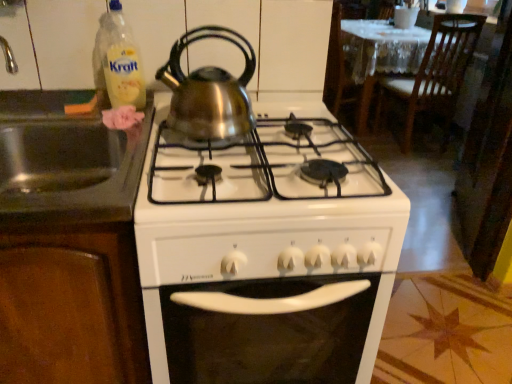
Locate an element on the screen. This screenshot has height=384, width=512. translucent plastic bottle at upper left is located at coordinates (121, 60).

Describe the element at coordinates (437, 73) in the screenshot. The height and width of the screenshot is (384, 512). I see `wooden chair at upper right` at that location.

The height and width of the screenshot is (384, 512). Find the location of `stained wood cabinet at left`. stained wood cabinet at left is located at coordinates (109, 277).

You are a GUI agent. You are given a task and a screenshot of the screen. Output one action in this format:
    pyautogui.click(x=<x>, y=<y>)
    Task: Click on the white glossy gas stove at center
    The image size is (512, 384).
    Given the screenshot: What is the action you would take?
    pyautogui.click(x=264, y=254)

Identify the location of translucent plastic bottle at upper left. This screenshot has height=384, width=512. (121, 60).

How different are the orientations of translucent plastic bottle at upper left and satin silver kettle at upper center in degrees?

The facing directions of translucent plastic bottle at upper left and satin silver kettle at upper center are 0.68 degrees apart.

Is translucent plastic bottle at upper left facing away from satin silver kettle at upper center?

translucent plastic bottle at upper left does not have its back to satin silver kettle at upper center.

Find the location of a particular element. bottle behind the satin silver kettle at upper center is located at coordinates (121, 60).

Is translucent plastic bottle at upper left not near satin silver kettle at upper center?

They are positioned close to each other.

Is stainless steel sink at left looking in the opposite direction of wooden chair at upper right?

No, wooden chair at upper right is not at the back of stainless steel sink at left.

Does stainless steel sink at left have a smaller size compared to wooden chair at upper right?

Yes.

Is point (13, 150) closer or farther from the camera than point (460, 20)?

Point (13, 150) appears to be closer to the viewer than point (460, 20).

Is point (245, 282) less distant than point (57, 205)?

Yes, point (245, 282) is in front of point (57, 205).

In the scene shown: Considering the positions of objects white glossy gas stove at center and stainless steel sink at left in the image provided, who is more to the right, white glossy gas stove at center or stainless steel sink at left?

Positioned to the right is white glossy gas stove at center.

Is white glossy gas stove at center oriented towards stainless steel sink at left?

No, white glossy gas stove at center is not turned towards stainless steel sink at left.

Considering the sizes of objects white glossy gas stove at center and stainless steel sink at left in the image provided, who is bigger, white glossy gas stove at center or stainless steel sink at left?

Bigger between the two is white glossy gas stove at center.

Who is smaller, satin silver kettle at upper center or wooden chair at upper right?

satin silver kettle at upper center.

Where is `chair behind the satin silver kettle at upper center`? The image size is (512, 384). chair behind the satin silver kettle at upper center is located at coordinates (437, 73).

Does point (233, 119) appear closer or farther from the camera than point (454, 59)?

Point (233, 119) appears to be closer to the viewer than point (454, 59).

Considering the relative sizes of translucent plastic bottle at upper left and stained wood cabinet at left in the image provided, is translucent plastic bottle at upper left thinner than stained wood cabinet at left?

Correct, the width of translucent plastic bottle at upper left is less than that of stained wood cabinet at left.

Is translucent plastic bottle at upper left spatially inside stained wood cabinet at left, or outside of it?

translucent plastic bottle at upper left cannot be found inside stained wood cabinet at left.

Based on their sizes in the image, would you say translucent plastic bottle at upper left is bigger or smaller than stained wood cabinet at left?

Considering their sizes, translucent plastic bottle at upper left takes up less space than stained wood cabinet at left.

Is translucent plastic bottle at upper left facing away from stained wood cabinet at left?

That's not correct — translucent plastic bottle at upper left is not looking away from stained wood cabinet at left.

Is stained wood cabinet at left bigger than white glossy gas stove at center?

Indeed, stained wood cabinet at left has a larger size compared to white glossy gas stove at center.

Between point (132, 335) and point (223, 144), which one is positioned in front?

The point (132, 335) is closer.

From a real-world perspective, who is located higher, stained wood cabinet at left or white glossy gas stove at center?

In real-world perspective, stained wood cabinet at left is above.

Based on the photo, can we say stainless steel sink at left lies outside translucent plastic bottle at upper left?

Yes, stainless steel sink at left is outside of translucent plastic bottle at upper left.

Can you confirm if stainless steel sink at left is wider than translucent plastic bottle at upper left?

Correct, the width of stainless steel sink at left exceeds that of translucent plastic bottle at upper left.

Is stainless steel sink at left closer to camera compared to translucent plastic bottle at upper left?

Yes.

From the image's perspective, is stainless steel sink at left located above translucent plastic bottle at upper left?

Incorrect, from the image's perspective, stainless steel sink at left is lower than translucent plastic bottle at upper left.

Locate an element on the screen. Image resolution: width=512 pixels, height=384 pixels. bottle that appears on the left of satin silver kettle at upper center is located at coordinates (121, 60).

You are a GUI agent. You are given a task and a screenshot of the screen. Output one action in this format:
    pyautogui.click(x=<x>, y=<y>)
    Task: Click on the chair located on the right of stainless steel sink at left
    
    Given the screenshot: What is the action you would take?
    pyautogui.click(x=437, y=73)

Consider the image. From the image, which object appears to be farther from translucent plastic bottle at upper left, satin silver kettle at upper center or stainless steel sink at left?

Answer: Among the two, stainless steel sink at left is located further to translucent plastic bottle at upper left.

When comparing their distances from stained wood cabinet at left, does satin silver kettle at upper center or white glossy gas stove at center seem closer?

white glossy gas stove at center is closer to stained wood cabinet at left.

Which object lies nearer to the anchor point white glossy gas stove at center, stained wood cabinet at left or satin silver kettle at upper center?

satin silver kettle at upper center lies closer to white glossy gas stove at center than the other object.

Which object lies nearer to the anchor point translucent plastic bottle at upper left, white glossy gas stove at center or wooden chair at upper right?

white glossy gas stove at center is positioned closer to the anchor translucent plastic bottle at upper left.

When comparing their distances from stainless steel sink at left, does wooden chair at upper right or white glossy gas stove at center seem further?

Among the two, wooden chair at upper right is located further to stainless steel sink at left.

Consider the image. Which object lies nearer to the anchor point stainless steel sink at left, white glossy gas stove at center or satin silver kettle at upper center?

Among the two, satin silver kettle at upper center is located nearer to stainless steel sink at left.

Which object lies further to the anchor point stainless steel sink at left, translucent plastic bottle at upper left or white glossy gas stove at center?

Among the two, white glossy gas stove at center is located further to stainless steel sink at left.

Which object lies further to the anchor point white glossy gas stove at center, wooden chair at upper right or stainless steel sink at left?

Based on the image, wooden chair at upper right appears to be further to white glossy gas stove at center.

The height and width of the screenshot is (384, 512). Find the location of `sink between satin silver kettle at upper center and white glossy gas stove at center in the up-down direction`. sink between satin silver kettle at upper center and white glossy gas stove at center in the up-down direction is located at coordinates (66, 161).

I want to click on kitchen appliance between white glossy gas stove at center and wooden chair at upper right from front to back, so click(208, 92).

This screenshot has height=384, width=512. Find the location of `sink between translucent plastic bottle at upper left and white glossy gas stove at center from top to bottom`. sink between translucent plastic bottle at upper left and white glossy gas stove at center from top to bottom is located at coordinates (66, 161).

Image resolution: width=512 pixels, height=384 pixels. In order to click on gas stove positioned between stained wood cabinet at left and wooden chair at upper right from near to far in this screenshot , I will do `click(264, 254)`.